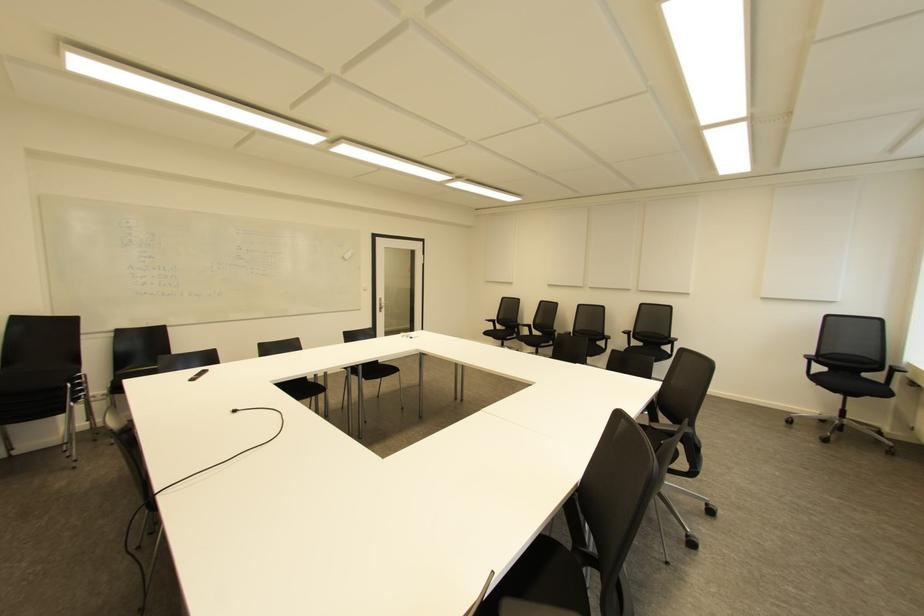
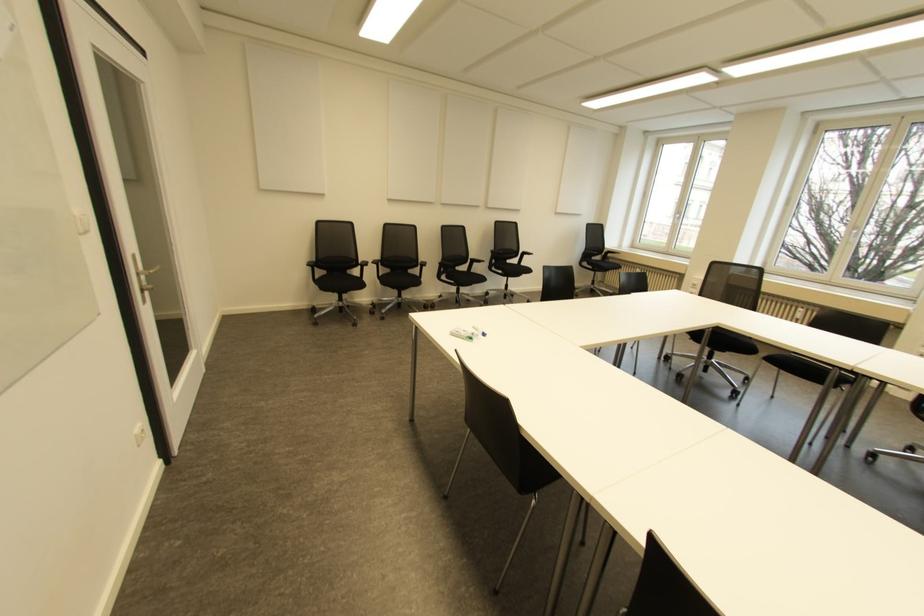
The point at (491, 322) is marked in the first image. Where is the corresponding point in the second image?

(310, 268)